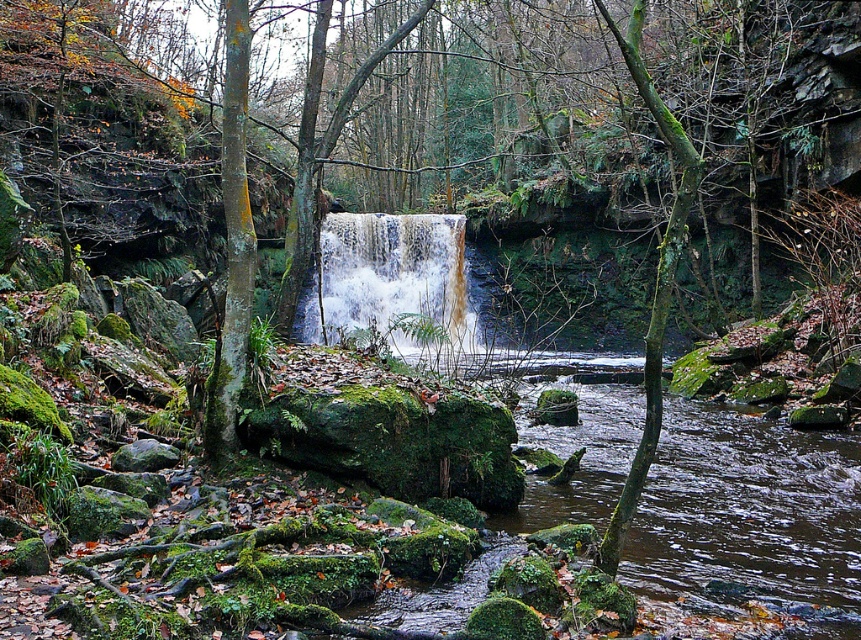
Question: Among these points, which one is nearest to the camera?

Choices:
 (A) (333, 259)
 (B) (533, 529)

Answer: (B)

Question: Does brown/muddy water at lower center have a smaller size compared to brown textured waterfall at center?

Choices:
 (A) yes
 (B) no

Answer: (A)

Question: Does brown/muddy water at lower center have a lesser width compared to brown textured waterfall at center?

Choices:
 (A) no
 (B) yes

Answer: (B)

Question: Is the position of brown/muddy water at lower center more distant than that of brown textured waterfall at center?

Choices:
 (A) no
 (B) yes

Answer: (A)

Question: Which of the following is the closest to the observer?

Choices:
 (A) (419, 236)
 (B) (748, 493)

Answer: (B)